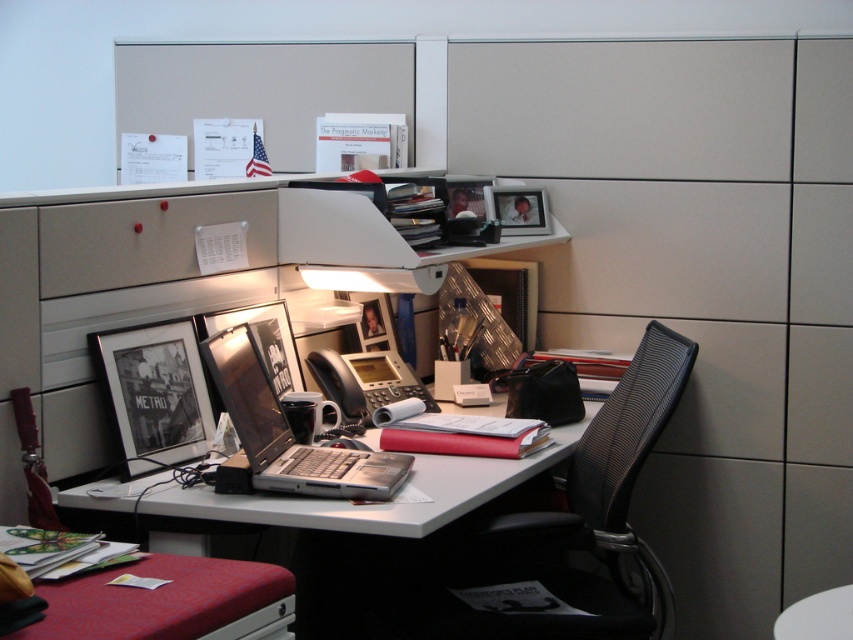
Question: Which object is closer to the camera taking this photo?

Choices:
 (A) silver metallic laptop at center
 (B) black mesh swivel chair at right

Answer: (A)

Question: Is metallic silver laptop at center thinner than metallic silver drawer at lower center?

Choices:
 (A) yes
 (B) no

Answer: (B)

Question: Estimate the real-world distances between objects in this image. Which object is farther from the silver metallic laptop at center?

Choices:
 (A) black mesh swivel chair at right
 (B) metallic silver drawer at lower center
 (C) metallic silver laptop at center

Answer: (A)

Question: Can you confirm if silver metallic laptop at center is positioned to the left of metallic silver drawer at lower center?

Choices:
 (A) no
 (B) yes

Answer: (B)

Question: Which object is closer to the camera taking this photo?

Choices:
 (A) metallic silver drawer at lower center
 (B) black mesh swivel chair at right

Answer: (A)

Question: Is metallic silver laptop at center to the right of metallic silver drawer at lower center from the viewer's perspective?

Choices:
 (A) yes
 (B) no

Answer: (A)